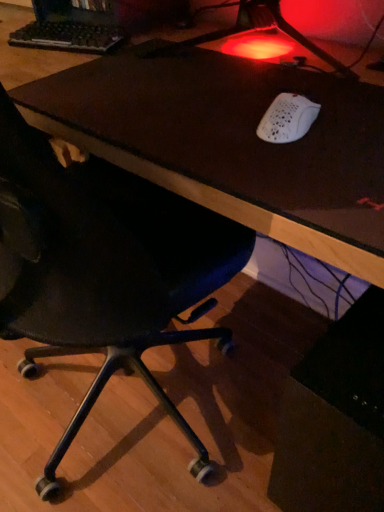
The height and width of the screenshot is (512, 384). Find the location of `vacant area that lies in front of white matte mouse at upper right`. vacant area that lies in front of white matte mouse at upper right is located at coordinates (307, 173).